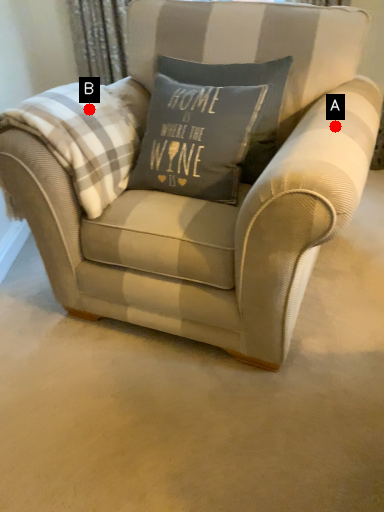
Question: Two points are circled on the image, labeled by A and B beside each circle. Which point is closer to the camera?

Choices:
 (A) A is closer
 (B) B is closer

Answer: (A)